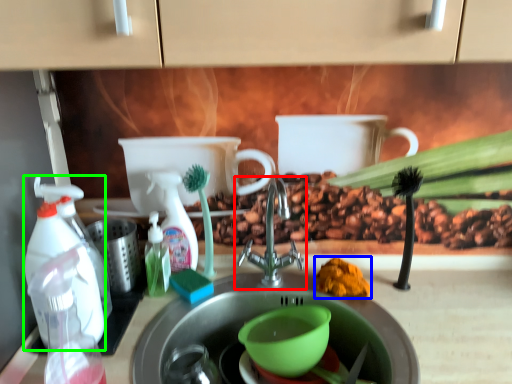
Question: Which object is the farthest from tap (highlighted by a red box)? Choose among these: debris (highlighted by a blue box) or cleaning product (highlighted by a green box).

Choices:
 (A) debris
 (B) cleaning product

Answer: (B)